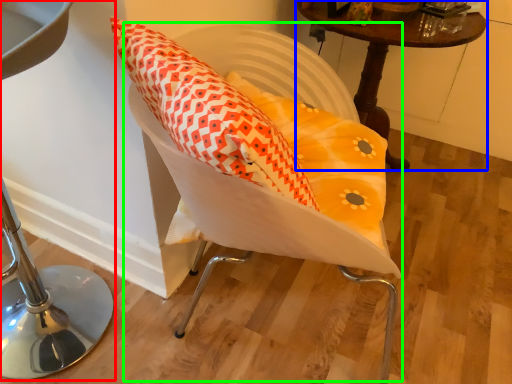
Question: Estimate the real-world distances between objects in this image. Which object is closer to furniture (highlighted by a red box), table (highlighted by a blue box) or swivel chair (highlighted by a green box)?

Choices:
 (A) table
 (B) swivel chair

Answer: (B)